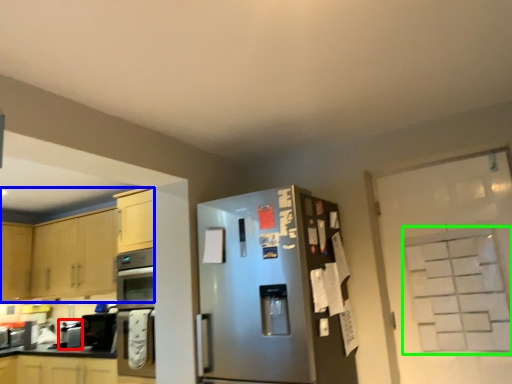
Question: Which is nearer to the appliance (highlighted by a red box)? cabinetry (highlighted by a blue box) or glass door (highlighted by a green box).

Choices:
 (A) cabinetry
 (B) glass door

Answer: (A)